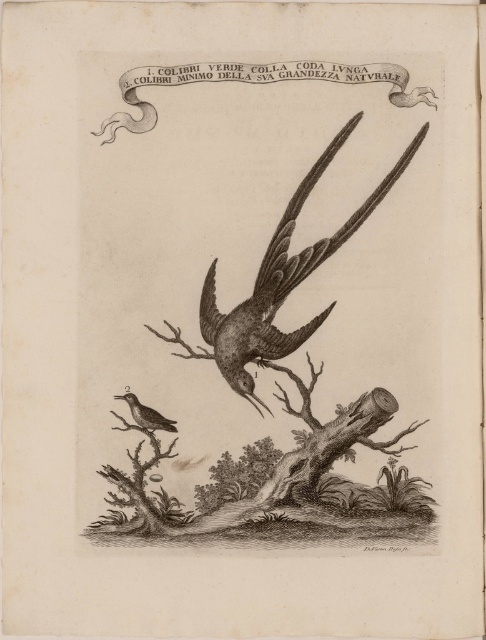
Is smooth wood tree trunk at lower center to the right of gray textured bird at center from the viewer's perspective?

No, smooth wood tree trunk at lower center is not to the right of gray textured bird at center.

Who is higher up, smooth wood tree trunk at lower center or gray textured bird at center?

gray textured bird at center

The image size is (486, 640). In order to click on smooth wood tree trunk at lower center in this screenshot , I will do (276, 486).

What are the coordinates of `smooth wood tree trunk at lower center` in the screenshot? It's located at (276, 486).

Which is below, gray textured bird at center or brown wood grain bird at lower left?

brown wood grain bird at lower left is lower down.

Between gray textured bird at center and brown wood grain bird at lower left, which one appears on the right side from the viewer's perspective?

From the viewer's perspective, gray textured bird at center appears more on the right side.

Does point (392, 170) come farther from viewer compared to point (169, 426)?

Yes.

Identify the location of gray textured bird at center. Image resolution: width=486 pixels, height=640 pixels. [279, 282].

Who is higher up, smooth wood tree trunk at lower center or brown wood grain bird at lower left?

Positioned higher is brown wood grain bird at lower left.

Is smooth wood tree trunk at lower center shorter than brown wood grain bird at lower left?

No, smooth wood tree trunk at lower center is not shorter than brown wood grain bird at lower left.

Who is more distant from viewer, (345, 413) or (138, 413)?

The point (345, 413) is more distant.

Locate an element on the screen. The image size is (486, 640). smooth wood tree trunk at lower center is located at coordinates (276, 486).